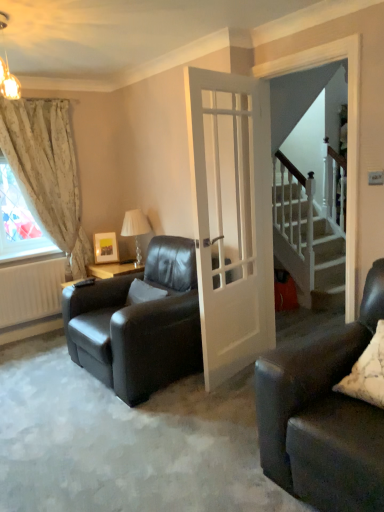
Question: From a real-world perspective, is floral fabric curtain at left physically located above or below white textured pillow at lower right, marked as the second pillow in a back-to-front arrangement?

Choices:
 (A) above
 (B) below

Answer: (A)

Question: Is floral fabric curtain at left taller or shorter than white textured pillow at lower right, arranged as the first pillow when viewed from the right?

Choices:
 (A) tall
 (B) short

Answer: (A)

Question: Which object is the farthest from the matte black armchair at center?

Choices:
 (A) white glass lamp at center
 (B) matte gold chandelier at upper left
 (C) white glossy door at center
 (D) floral fabric curtain at left
 (E) white matte radiator at lower left

Answer: (B)

Question: Considering the real-world distances, which object is farthest from the floral fabric curtain at left?

Choices:
 (A) white soft pillow at center, the 1th pillow positioned from the left
 (B) white textured pillow at lower right, marked as the second pillow in a back-to-front arrangement
 (C) white glass lamp at center
 (D) white matte radiator at lower left
 (E) matte gold chandelier at upper left

Answer: (B)